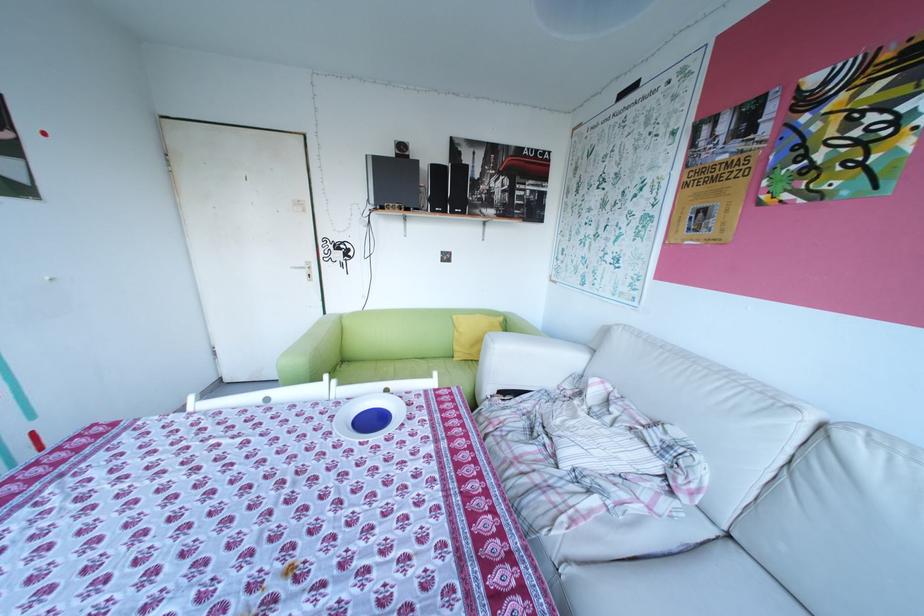
Where would you resting arm the white sofa armrest? Please return your answer as a coordinate pair (x, y).

(531, 368)